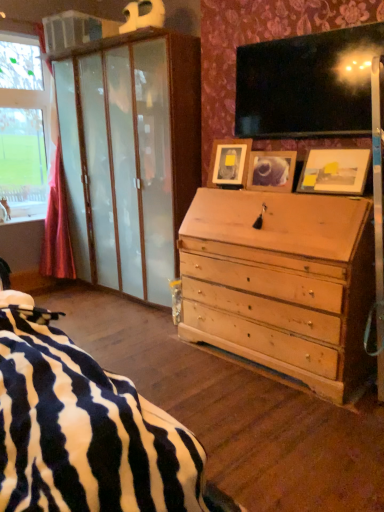
This screenshot has width=384, height=512. What are the coordinates of `wooden picture frame at center, which ranks as the third picture frame in right-to-left order` in the screenshot? It's located at (229, 162).

Locate an element on the screen. the 2nd picture frame below when counting from the wooden picture frame at center, which ranks as the third picture frame in right-to-left order (from the image's perspective) is located at coordinates (335, 170).

Is wooden photo frame at upper right, positioned as the first picture frame in right-to-left order, bigger than wooden picture frame at center, the 1th picture frame positioned from the left?

Yes.

Is wooden photo frame at upper right, positioned as the first picture frame in right-to-left order, with wooden picture frame at center, which ranks as the third picture frame in right-to-left order?

No.

Is wooden photo frame at upper right, marked as the 3th picture frame in a left-to-right arrangement, spatially inside wooden picture frame at center, which ranks as the third picture frame in right-to-left order, or outside of it?

wooden photo frame at upper right, marked as the 3th picture frame in a left-to-right arrangement, is not enclosed by wooden picture frame at center, which ranks as the third picture frame in right-to-left order.

Between point (257, 158) and point (342, 157), which one is positioned in front?

The point (342, 157) is closer to the camera.

How distant is wooden picture frame at center, acting as the second picture frame starting from the right, from wooden photo frame at upper right, marked as the 3th picture frame in a left-to-right arrangement?

wooden picture frame at center, acting as the second picture frame starting from the right, and wooden photo frame at upper right, marked as the 3th picture frame in a left-to-right arrangement, are 10.24 inches apart.

Consider the image. Is the position of wooden picture frame at center, positioned as the 2th picture frame in left-to-right order, more distant than that of wooden photo frame at upper right, positioned as the first picture frame in right-to-left order?

Yes, wooden picture frame at center, positioned as the 2th picture frame in left-to-right order, is further from the viewer.

Between wooden picture frame at center, acting as the second picture frame starting from the right, and wooden photo frame at upper right, marked as the 3th picture frame in a left-to-right arrangement, which one has more height?

With more height is wooden photo frame at upper right, marked as the 3th picture frame in a left-to-right arrangement.

Which object is further away from the camera, wooden picture frame at center, which ranks as the third picture frame in right-to-left order, or wooden photo frame at upper right, marked as the 3th picture frame in a left-to-right arrangement?

wooden picture frame at center, which ranks as the third picture frame in right-to-left order, is further away from the camera.

Considering the positions of points (231, 185) and (328, 191), is point (231, 185) farther from camera compared to point (328, 191)?

Yes.

Between wooden picture frame at center, which ranks as the third picture frame in right-to-left order, and wooden photo frame at upper right, positioned as the first picture frame in right-to-left order, which one appears on the left side from the viewer's perspective?

wooden picture frame at center, which ranks as the third picture frame in right-to-left order, is more to the left.

Is wooden picture frame at center, the 1th picture frame positioned from the left, positioned with its back to wooden photo frame at upper right, positioned as the first picture frame in right-to-left order?

No, wooden picture frame at center, the 1th picture frame positioned from the left, is not facing the opposite direction of wooden photo frame at upper right, positioned as the first picture frame in right-to-left order.

From the image's perspective, is wooden picture frame at center, which ranks as the third picture frame in right-to-left order, located above or below wooden picture frame at center, acting as the second picture frame starting from the right?

wooden picture frame at center, which ranks as the third picture frame in right-to-left order, is above wooden picture frame at center, acting as the second picture frame starting from the right.

Can you confirm if wooden picture frame at center, which ranks as the third picture frame in right-to-left order, is taller than wooden picture frame at center, acting as the second picture frame starting from the right?

Yes, wooden picture frame at center, which ranks as the third picture frame in right-to-left order, is taller than wooden picture frame at center, acting as the second picture frame starting from the right.

Can you see wooden picture frame at center, the 1th picture frame positioned from the left, touching wooden picture frame at center, positioned as the 2th picture frame in left-to-right order?

wooden picture frame at center, the 1th picture frame positioned from the left, is not next to wooden picture frame at center, positioned as the 2th picture frame in left-to-right order, and they're not touching.

Is wooden picture frame at center, acting as the second picture frame starting from the right, at the back of wooden picture frame at center, which ranks as the third picture frame in right-to-left order?

No, wooden picture frame at center, which ranks as the third picture frame in right-to-left order, is not facing away from wooden picture frame at center, acting as the second picture frame starting from the right.

You are a GUI agent. You are given a task and a screenshot of the screen. Output one action in this format:
    pyautogui.click(x=<x>, y=<y>)
    Task: Click on the picture frame lying below the wooden picture frame at center, acting as the second picture frame starting from the right (from the image's perspective)
    This screenshot has width=384, height=512.
    Given the screenshot: What is the action you would take?
    pyautogui.click(x=335, y=170)

Is the position of wooden photo frame at upper right, marked as the 3th picture frame in a left-to-right arrangement, more distant than that of wooden picture frame at center, acting as the second picture frame starting from the right?

No, the depth of wooden photo frame at upper right, marked as the 3th picture frame in a left-to-right arrangement, is less than that of wooden picture frame at center, acting as the second picture frame starting from the right.

Can you tell me how much wooden photo frame at upper right, positioned as the first picture frame in right-to-left order, and wooden picture frame at center, positioned as the 2th picture frame in left-to-right order, differ in facing direction?

The facing directions of wooden photo frame at upper right, positioned as the first picture frame in right-to-left order, and wooden picture frame at center, positioned as the 2th picture frame in left-to-right order, are 4.89 degrees apart.

From the image's perspective, which one is positioned higher, wooden photo frame at upper right, marked as the 3th picture frame in a left-to-right arrangement, or wooden picture frame at center, positioned as the 2th picture frame in left-to-right order?

wooden picture frame at center, positioned as the 2th picture frame in left-to-right order, from the image's perspective.

Considering the sizes of objects wooden picture frame at center, acting as the second picture frame starting from the right, and wooden picture frame at center, which ranks as the third picture frame in right-to-left order, in the image provided, who is smaller, wooden picture frame at center, acting as the second picture frame starting from the right, or wooden picture frame at center, which ranks as the third picture frame in right-to-left order,?

wooden picture frame at center, acting as the second picture frame starting from the right.

Who is taller, wooden picture frame at center, positioned as the 2th picture frame in left-to-right order, or wooden picture frame at center, the 1th picture frame positioned from the left?

Standing taller between the two is wooden picture frame at center, the 1th picture frame positioned from the left.

Consider the image. From the image's perspective, relative to wooden picture frame at center, the 1th picture frame positioned from the left, is wooden picture frame at center, positioned as the 2th picture frame in left-to-right order, above or below?

wooden picture frame at center, positioned as the 2th picture frame in left-to-right order, is below wooden picture frame at center, the 1th picture frame positioned from the left.

How many degrees apart are the facing directions of wooden picture frame at center, acting as the second picture frame starting from the right, and wooden picture frame at center, the 1th picture frame positioned from the left?

The facing directions of wooden picture frame at center, acting as the second picture frame starting from the right, and wooden picture frame at center, the 1th picture frame positioned from the left, are 10.8 degrees apart.

At what (x,y) coordinates should I click in order to perform the action: click on picture frame that is the 2nd object located below the wooden picture frame at center, the 1th picture frame positioned from the left (from the image's perspective). Please return your answer as a coordinate pair (x, y). Image resolution: width=384 pixels, height=512 pixels. Looking at the image, I should click on (335, 170).

You are a GUI agent. You are given a task and a screenshot of the screen. Output one action in this format:
    pyautogui.click(x=<x>, y=<y>)
    Task: Click on the picture frame below the wooden photo frame at upper right, positioned as the first picture frame in right-to-left order (from a real-world perspective)
    The height and width of the screenshot is (512, 384).
    Given the screenshot: What is the action you would take?
    pyautogui.click(x=271, y=170)

Based on their spatial positions, is wooden picture frame at center, which ranks as the third picture frame in right-to-left order, or wooden picture frame at center, positioned as the 2th picture frame in left-to-right order, further from wooden photo frame at upper right, marked as the 3th picture frame in a left-to-right arrangement?

wooden picture frame at center, which ranks as the third picture frame in right-to-left order, lies further to wooden photo frame at upper right, marked as the 3th picture frame in a left-to-right arrangement, than the other object.

When comparing their distances from wooden photo frame at upper right, marked as the 3th picture frame in a left-to-right arrangement, does wooden picture frame at center, positioned as the 2th picture frame in left-to-right order, or wooden picture frame at center, which ranks as the third picture frame in right-to-left order, seem further?

wooden picture frame at center, which ranks as the third picture frame in right-to-left order, is positioned further to the anchor wooden photo frame at upper right, marked as the 3th picture frame in a left-to-right arrangement.

Looking at the image, which one is located further to wooden picture frame at center, the 1th picture frame positioned from the left, wooden picture frame at center, positioned as the 2th picture frame in left-to-right order, or wooden photo frame at upper right, positioned as the first picture frame in right-to-left order?

wooden photo frame at upper right, positioned as the first picture frame in right-to-left order, lies further to wooden picture frame at center, the 1th picture frame positioned from the left, than the other object.

When comparing their distances from wooden picture frame at center, which ranks as the third picture frame in right-to-left order, does wooden photo frame at upper right, positioned as the first picture frame in right-to-left order, or wooden picture frame at center, positioned as the 2th picture frame in left-to-right order, seem closer?

Among the two, wooden picture frame at center, positioned as the 2th picture frame in left-to-right order, is located nearer to wooden picture frame at center, which ranks as the third picture frame in right-to-left order.

Considering their positions, is wooden photo frame at upper right, marked as the 3th picture frame in a left-to-right arrangement, positioned further to wooden picture frame at center, positioned as the 2th picture frame in left-to-right order, than wooden picture frame at center, which ranks as the third picture frame in right-to-left order?

The object further to wooden picture frame at center, positioned as the 2th picture frame in left-to-right order, is wooden photo frame at upper right, marked as the 3th picture frame in a left-to-right arrangement.

Based on their spatial positions, is wooden picture frame at center, which ranks as the third picture frame in right-to-left order, or wooden photo frame at upper right, positioned as the first picture frame in right-to-left order, further from wooden picture frame at center, acting as the second picture frame starting from the right?

wooden photo frame at upper right, positioned as the first picture frame in right-to-left order, is further to wooden picture frame at center, acting as the second picture frame starting from the right.

The width and height of the screenshot is (384, 512). Find the location of `picture frame situated between wooden picture frame at center, the 1th picture frame positioned from the left, and wooden photo frame at upper right, marked as the 3th picture frame in a left-to-right arrangement, from left to right`. picture frame situated between wooden picture frame at center, the 1th picture frame positioned from the left, and wooden photo frame at upper right, marked as the 3th picture frame in a left-to-right arrangement, from left to right is located at coordinates (271, 170).